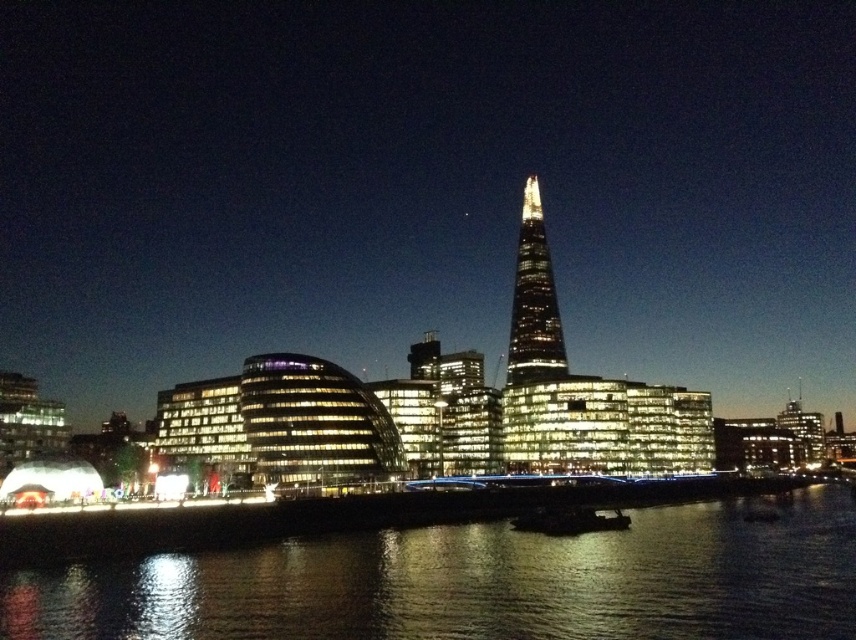
Can you confirm if black reflective water at lower center is shorter than glassy reflective skyscraper at center?

Yes.

Is point (510, 611) closer to viewer compared to point (519, 291)?

Yes, point (510, 611) is closer to viewer.

This screenshot has height=640, width=856. What are the coordinates of `black reflective water at lower center` in the screenshot? It's located at (479, 582).